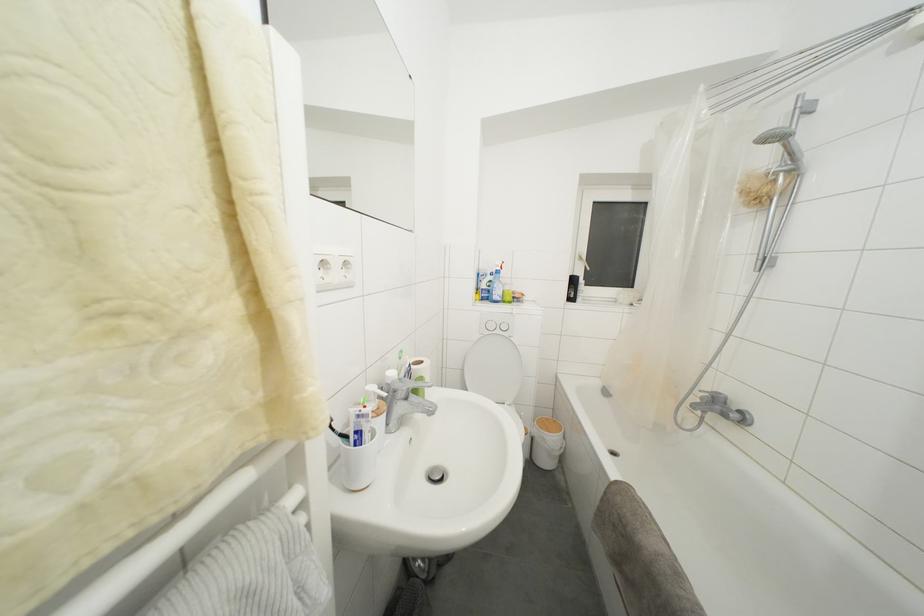
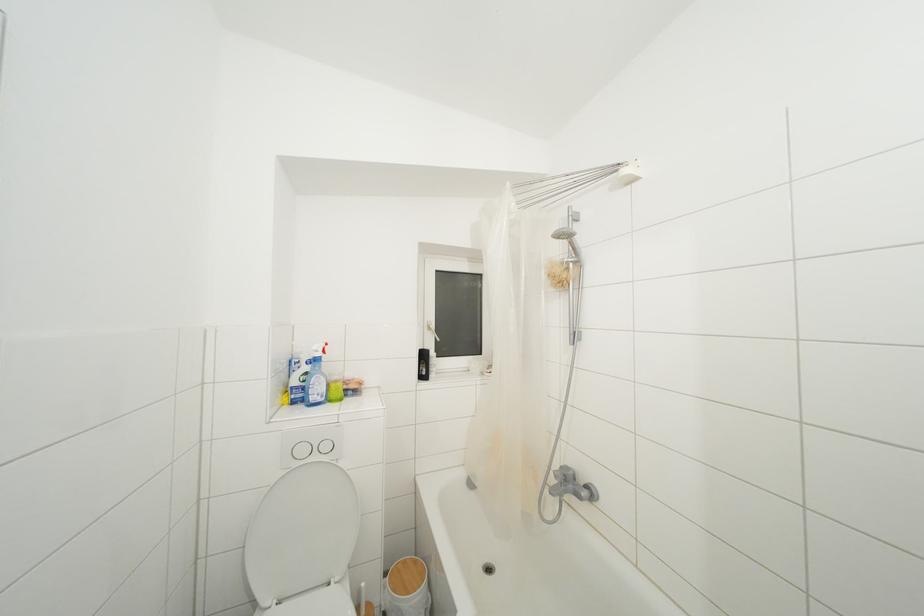
In the second image, find the point that corresponds to (585,264) in the first image.

(433, 333)